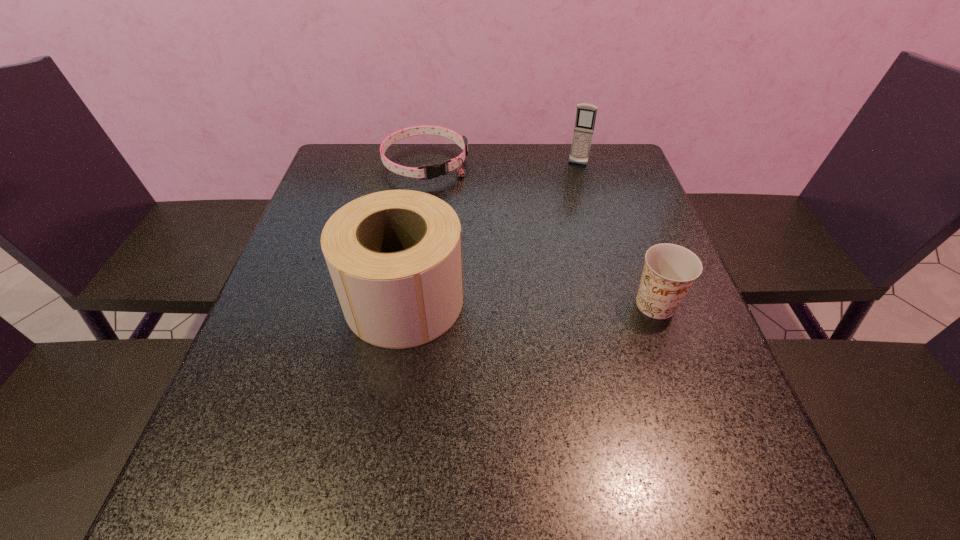
I want to click on free space between the cellular telephone and the Dixie cup, so (x=616, y=234).

Where is `free spot between the shortest object and the cellular telephone`? The height and width of the screenshot is (540, 960). free spot between the shortest object and the cellular telephone is located at coordinates (502, 164).

At what (x,y) coordinates should I click in order to perform the action: click on vacant space that is in between the third tallest object and the dog collar. Please return your answer as a coordinate pair (x, y). Image resolution: width=960 pixels, height=540 pixels. Looking at the image, I should click on (540, 234).

At what (x,y) coordinates should I click in order to perform the action: click on free space between the dog collar and the cellular telephone. Please return your answer as a coordinate pair (x, y). The height and width of the screenshot is (540, 960). Looking at the image, I should click on (502, 164).

Choose which object is the nearest neighbor to the third tallest object. Please provide its 2D coordinates. Your answer should be formatted as a tuple, i.e. [(x, y)], where the tuple contains the x and y coordinates of a point satisfying the conditions above.

[(395, 257)]

Select which object is the closest to the cellular telephone. Please provide its 2D coordinates. Your answer should be formatted as a tuple, i.e. [(x, y)], where the tuple contains the x and y coordinates of a point satisfying the conditions above.

[(435, 170)]

Where is `vacant space that satisfies the following two spatial constraints: 1. on the front side of the cellular telephone; 2. on the right side of the Dixie cup`? The height and width of the screenshot is (540, 960). vacant space that satisfies the following two spatial constraints: 1. on the front side of the cellular telephone; 2. on the right side of the Dixie cup is located at coordinates (617, 305).

I want to click on free location that satisfies the following two spatial constraints: 1. on the front side of the Dixie cup; 2. on the right side of the cellular telephone, so click(x=617, y=305).

The width and height of the screenshot is (960, 540). Find the location of `free spot that satisfies the following two spatial constraints: 1. on the front side of the third tallest object; 2. on the right side of the toilet tissue`. free spot that satisfies the following two spatial constraints: 1. on the front side of the third tallest object; 2. on the right side of the toilet tissue is located at coordinates (403, 305).